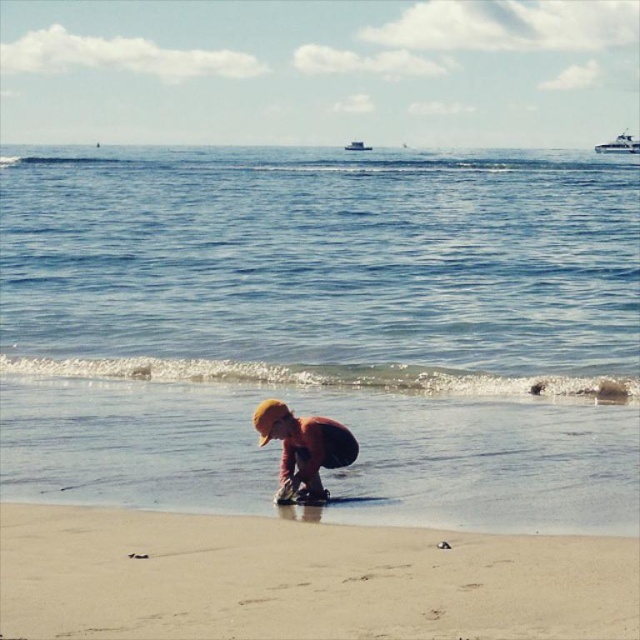
Question: Which point is closer to the camera taking this photo?

Choices:
 (A) (360, 147)
 (B) (285, 451)
 (C) (467, 589)
 (D) (637, 140)

Answer: (C)

Question: Does sandy yellow at lower center have a smaller size compared to white plastic boat at upper center?

Choices:
 (A) no
 (B) yes

Answer: (B)

Question: Which is farther from the orange fabric boy at center?

Choices:
 (A) sandy yellow at lower center
 (B) white plastic boat at upper center
 (C) blue water at center
 (D) white glossy boat at upper right

Answer: (B)

Question: Which point appears closest to the camera in this image?

Choices:
 (A) (348, 150)
 (B) (337, 448)

Answer: (B)

Question: Can you confirm if blue water at center is smaller than white plastic boat at upper center?

Choices:
 (A) no
 (B) yes

Answer: (A)

Question: Can you confirm if white glossy boat at upper right is bigger than white plastic boat at upper center?

Choices:
 (A) no
 (B) yes

Answer: (B)